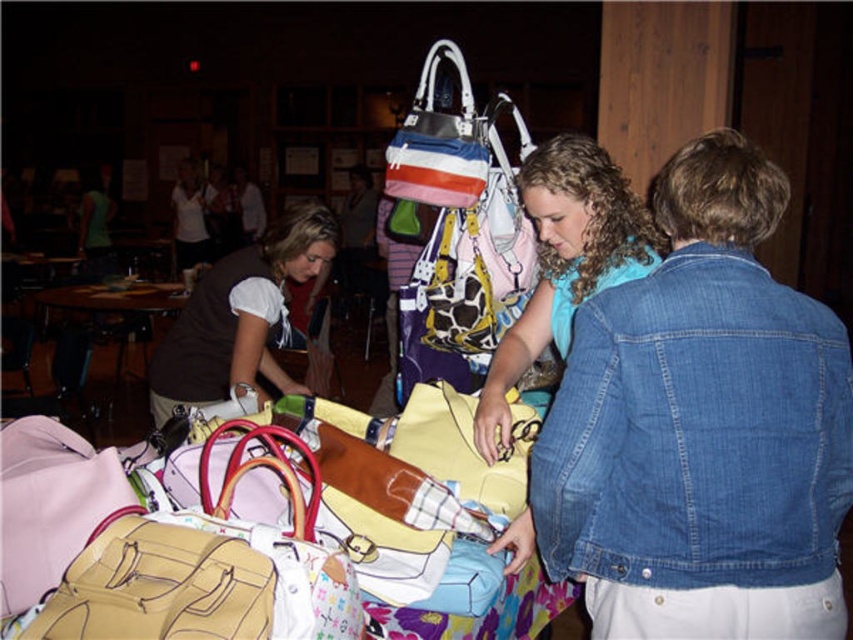
From the picture: Is denim jacket at lower right taller than brown fabric shirt at upper left?

Indeed, denim jacket at lower right has a greater height compared to brown fabric shirt at upper left.

Who is positioned more to the left, denim jacket at lower right or brown fabric shirt at upper left?

From the viewer's perspective, brown fabric shirt at upper left appears more on the left side.

Is point (671, 500) closer to camera compared to point (209, 397)?

Yes, it is.

You are a GUI agent. You are given a task and a screenshot of the screen. Output one action in this format:
    pyautogui.click(x=<x>, y=<y>)
    Task: Click on the denim jacket at lower right
    The width and height of the screenshot is (853, 640).
    Given the screenshot: What is the action you would take?
    pyautogui.click(x=701, y=428)

Does matte yellow purse at center appear under wooden round table at center?

Correct, matte yellow purse at center is located below wooden round table at center.

Is point (567, 305) positioned behind point (136, 291)?

No, it is not.

Where is `matte yellow purse at center`? matte yellow purse at center is located at coordinates (564, 262).

Between striped canvas tote at center and wooden round table at center, which one has more height?

wooden round table at center

Does striped canvas tote at center have a greater width compared to wooden round table at center?

No.

Image resolution: width=853 pixels, height=640 pixels. What do you see at coordinates (439, 141) in the screenshot? I see `striped canvas tote at center` at bounding box center [439, 141].

You are a GUI agent. You are given a task and a screenshot of the screen. Output one action in this format:
    pyautogui.click(x=<x>, y=<y>)
    Task: Click on the striped canvas tote at center
    Image resolution: width=853 pixels, height=640 pixels.
    Given the screenshot: What is the action you would take?
    pyautogui.click(x=439, y=141)